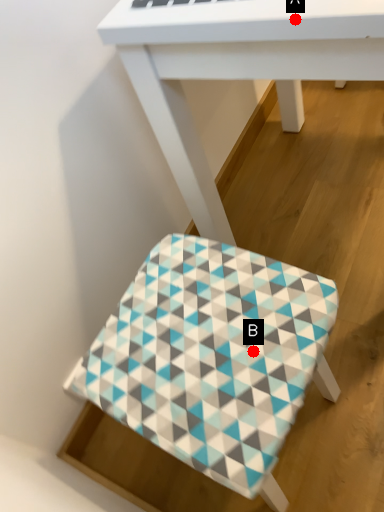
Question: Two points are circled on the image, labeled by A and B beside each circle. Which point is farther from the camera taking this photo?

Choices:
 (A) A is further
 (B) B is further

Answer: (B)